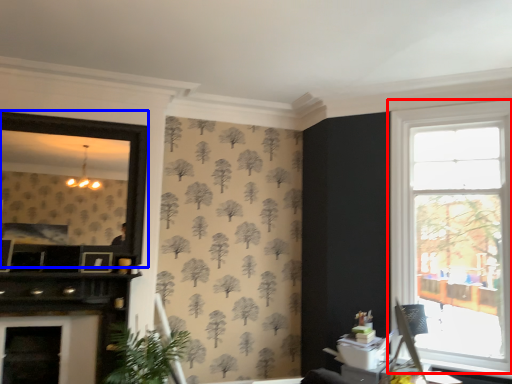
Question: Which of the following is the farthest to the observer, window (highlighted by a red box) or window screen (highlighted by a blue box)?

Choices:
 (A) window
 (B) window screen

Answer: (B)